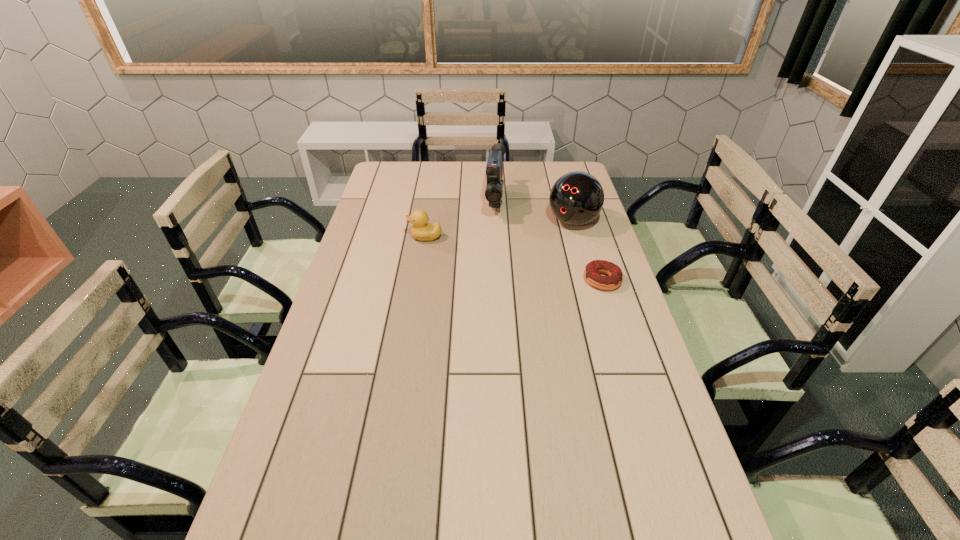
The height and width of the screenshot is (540, 960). In order to click on vacant space on the desktop that is between the leftmost object and the nearest object and is positioned on the surface of the bowling ball near the finger holes in this screenshot , I will do coord(529,262).

This screenshot has width=960, height=540. Find the location of `vacant spot on the desktop that is between the leftmost object and the nearest object and is positioned on the front-facing side of the second object from left to right`. vacant spot on the desktop that is between the leftmost object and the nearest object and is positioned on the front-facing side of the second object from left to right is located at coordinates (493, 253).